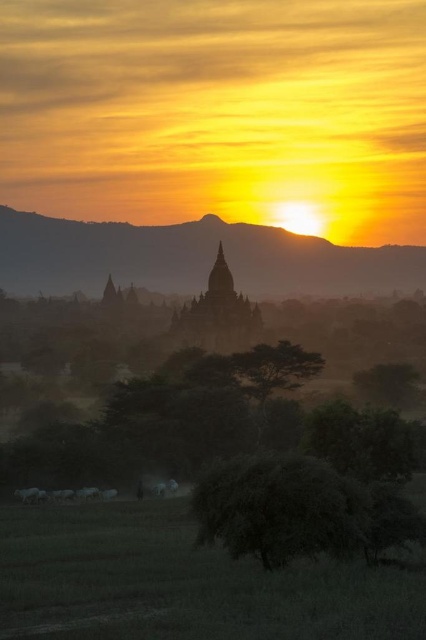
Question: Which point is farther from the camera taking this photo?

Choices:
 (A) (120, 532)
 (B) (233, 300)

Answer: (B)

Question: Which object is closer to the camera taking this photo?

Choices:
 (A) green leafy tree at center
 (B) dark gray stone temple at center
 (C) green grassy field at lower center

Answer: (C)

Question: Which object is positioned closest to the green leafy tree at center?

Choices:
 (A) dark gray stone temple at center
 (B) green grassy field at lower center

Answer: (B)

Question: Can you confirm if green grassy field at lower center is thinner than green leafy tree at center?

Choices:
 (A) no
 (B) yes

Answer: (A)

Question: Does green grassy field at lower center appear on the right side of dark gray stone temple at center?

Choices:
 (A) yes
 (B) no

Answer: (B)

Question: Is dark gray stone temple at center bigger than green leafy tree at center?

Choices:
 (A) no
 (B) yes

Answer: (B)